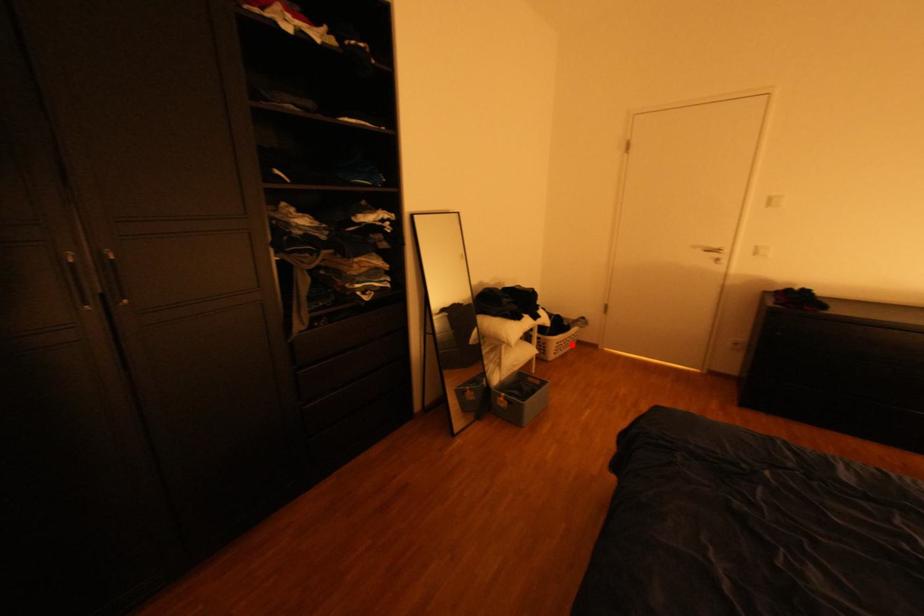
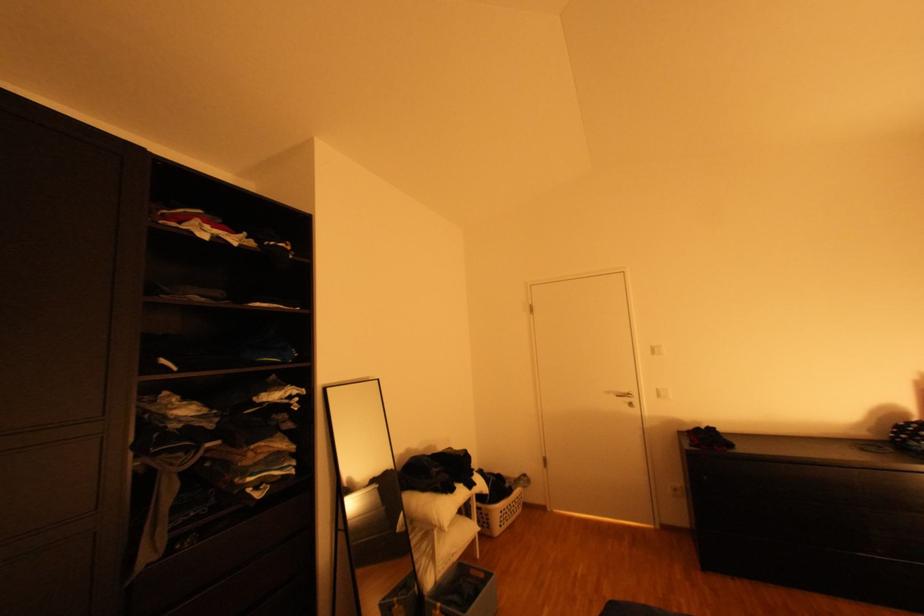
The point at the highlighted location is marked in the first image. Where is the corresponding point in the second image?

(516, 513)